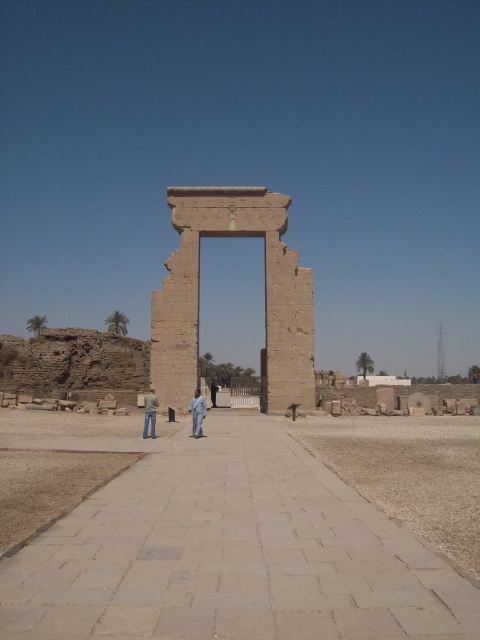
Question: Which object appears farthest from the camera in this image?

Choices:
 (A) light brown fabric at center
 (B) beige stone archway at center

Answer: (B)

Question: Which point appears farthest from the camera in this image?

Choices:
 (A) (145, 426)
 (B) (195, 403)

Answer: (B)

Question: Does light brown fabric at center appear under jeans at center?

Choices:
 (A) no
 (B) yes

Answer: (A)

Question: Is beige stone archway at center in front of light brown fabric at center?

Choices:
 (A) no
 (B) yes

Answer: (A)

Question: Which point is farther from the camera taking this photo?

Choices:
 (A) (145, 394)
 (B) (180, 300)
 (C) (199, 428)

Answer: (A)

Question: Observing the image, what is the correct spatial positioning of beige stone archway at center in reference to jeans at center?

Choices:
 (A) above
 (B) below

Answer: (A)